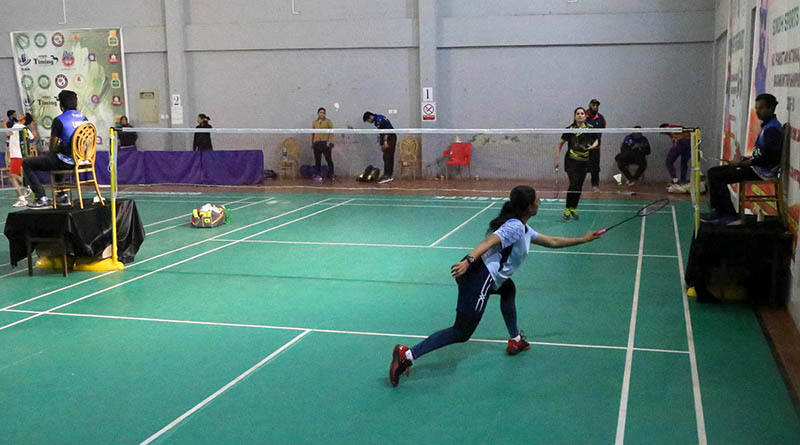
You are a GUI agent. You are given a task and a screenshot of the screen. Output one action in this format:
    pyautogui.click(x=<x>, y=<y>)
    Task: Click on the black tablecloth
    
    Given the screenshot: What is the action you would take?
    pyautogui.click(x=50, y=234)